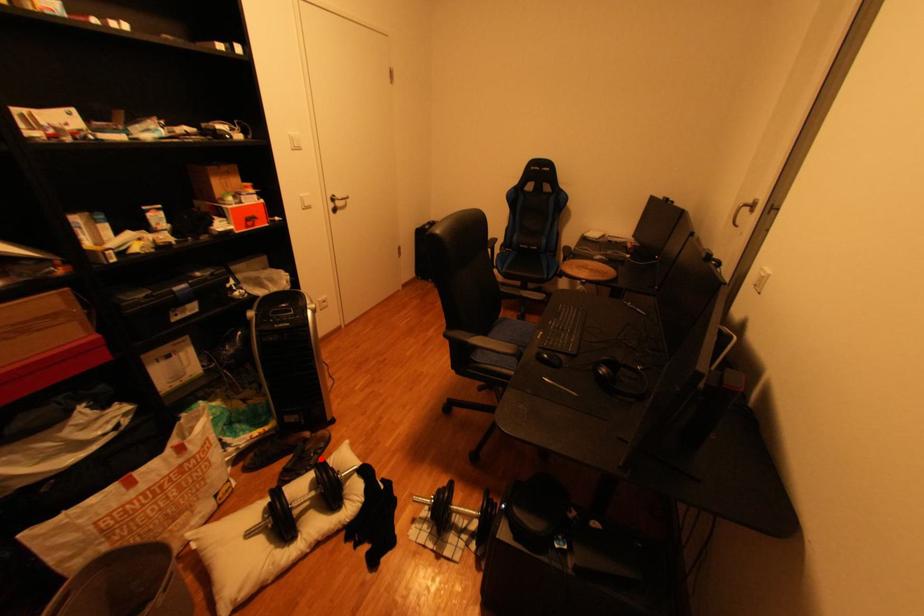
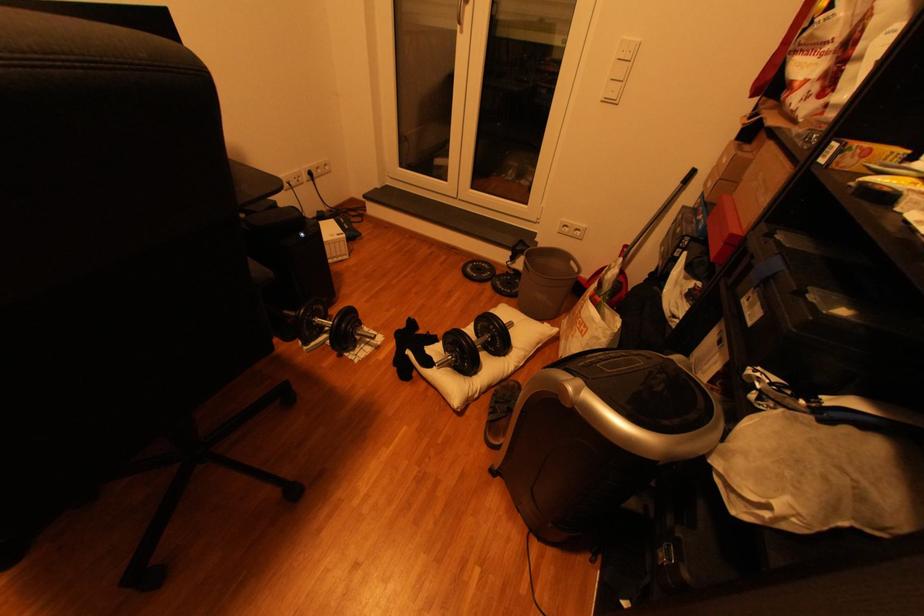
Question: I am providing you with two images of the same scene from different viewpoints. Given a red point in image1, look at the same physical point in image2. Is it:

Choices:
 (A) Closer to the viewpoint
 (B) Farther from the viewpoint

Answer: (B)